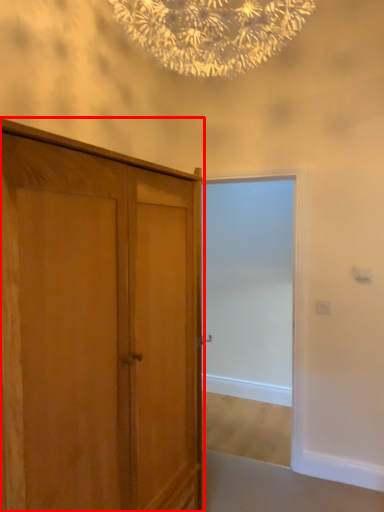
Question: From the image's perspective, what is the correct spatial relationship of cupboard (annotated by the red box) in relation to screen door?

Choices:
 (A) below
 (B) above

Answer: (A)